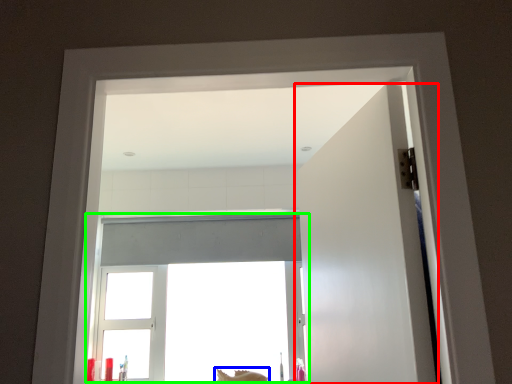
Question: Which object is the closest to the door (highlighted by a red box)? Choose among these: animal (highlighted by a blue box) or window (highlighted by a green box).

Choices:
 (A) animal
 (B) window

Answer: (B)